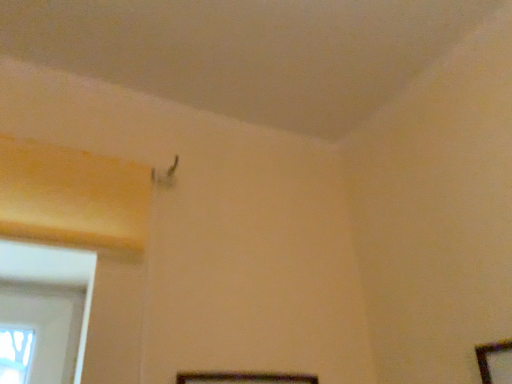
Question: From a real-world perspective, is wooden picture frame at lower center, the second picture frame from the right, above or below wooden picture frame at lower right, the 1th picture frame from the right?

Choices:
 (A) above
 (B) below

Answer: (B)

Question: Is wooden picture frame at lower center, which appears as the first picture frame when viewed from the left, in front of or behind wooden picture frame at lower right, the 1th picture frame from the right, in the image?

Choices:
 (A) behind
 (B) front

Answer: (A)

Question: From the image's perspective, is wooden picture frame at lower center, the second picture frame from the right, above or below wooden picture frame at lower right, the 1th picture frame from the right?

Choices:
 (A) below
 (B) above

Answer: (A)

Question: In terms of width, does wooden picture frame at lower right, the 1th picture frame from the right, look wider or thinner when compared to wooden picture frame at lower center, the second picture frame from the right?

Choices:
 (A) wide
 (B) thin

Answer: (A)

Question: Is wooden picture frame at lower right, the second picture frame positioned from the left, situated inside wooden picture frame at lower center, which appears as the first picture frame when viewed from the left, or outside?

Choices:
 (A) inside
 (B) outside

Answer: (B)

Question: Is wooden picture frame at lower right, the second picture frame positioned from the left, in front of or behind wooden picture frame at lower center, the second picture frame from the right, in the image?

Choices:
 (A) behind
 (B) front

Answer: (B)

Question: In terms of size, does wooden picture frame at lower right, the second picture frame positioned from the left, appear bigger or smaller than wooden picture frame at lower center, which appears as the first picture frame when viewed from the left?

Choices:
 (A) small
 (B) big

Answer: (B)